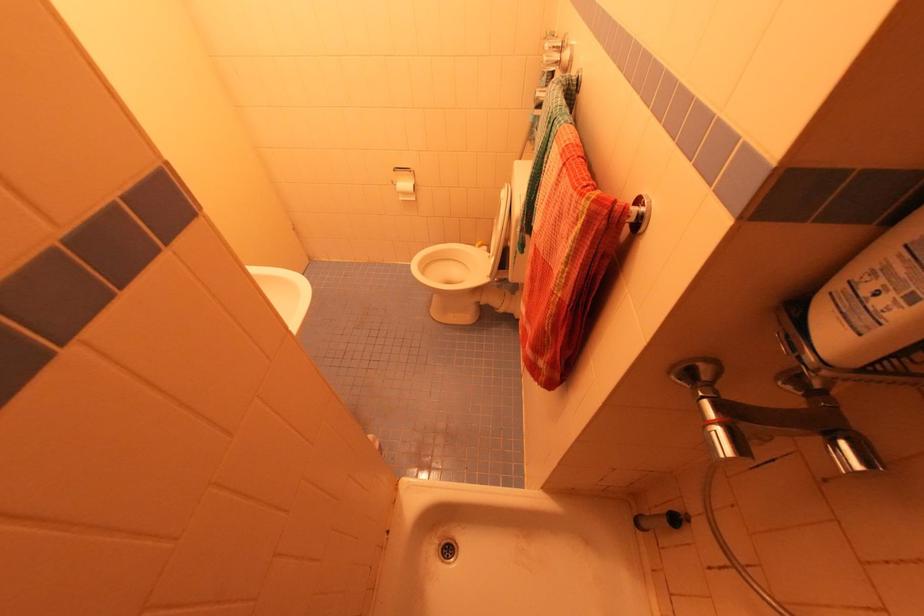
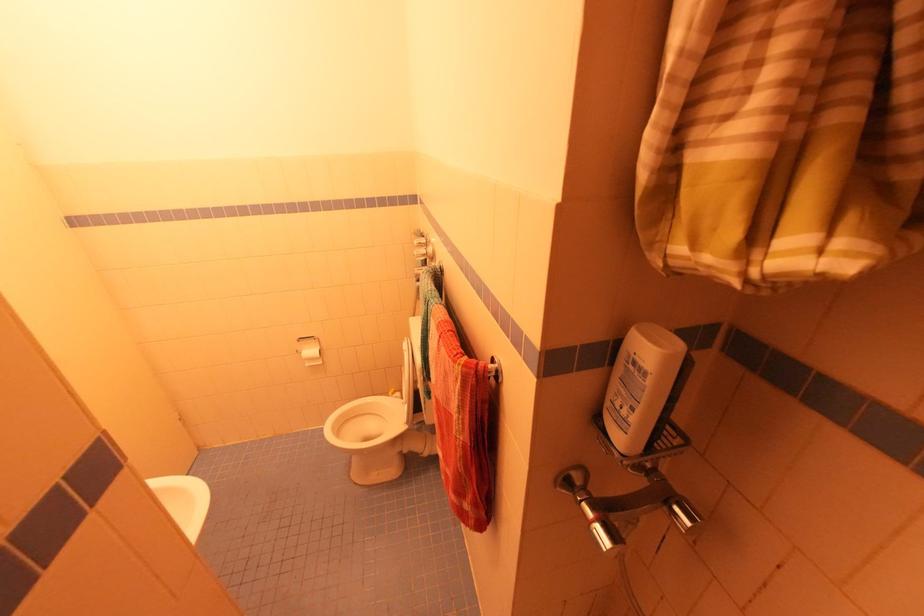
Where in the second image is the point corresponding to point (881, 302) from the first image?

(626, 413)